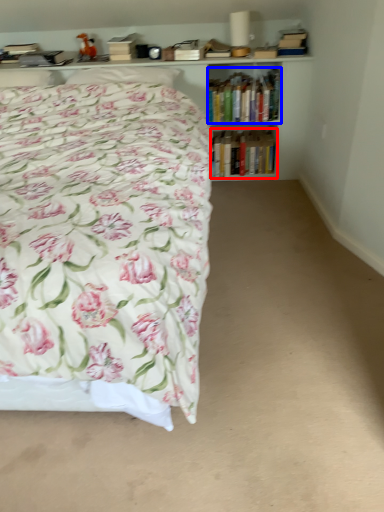
Question: Which of the following is the closest to the observer, book (highlighted by a red box) or book (highlighted by a blue box)?

Choices:
 (A) book
 (B) book

Answer: (B)